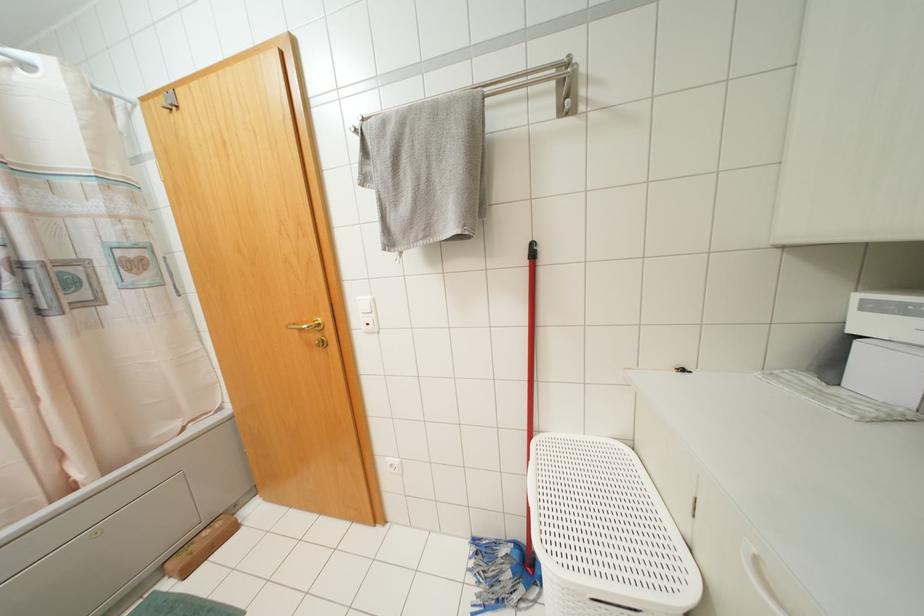
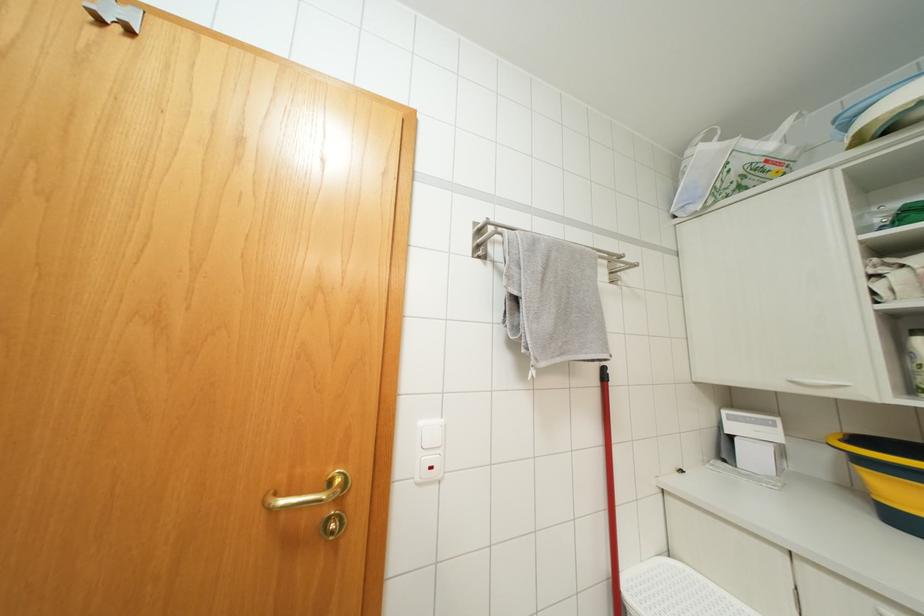
Based on the continuous images, in which direction is the camera rotating?

The camera rotated toward right-up.